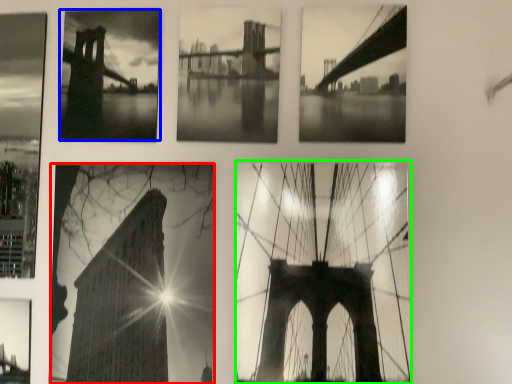
Question: Considering the real-world distances, which object is farthest from picture frame (highlighted by a red box)? picture frame (highlighted by a blue box) or picture frame (highlighted by a green box)?

Choices:
 (A) picture frame
 (B) picture frame

Answer: (A)